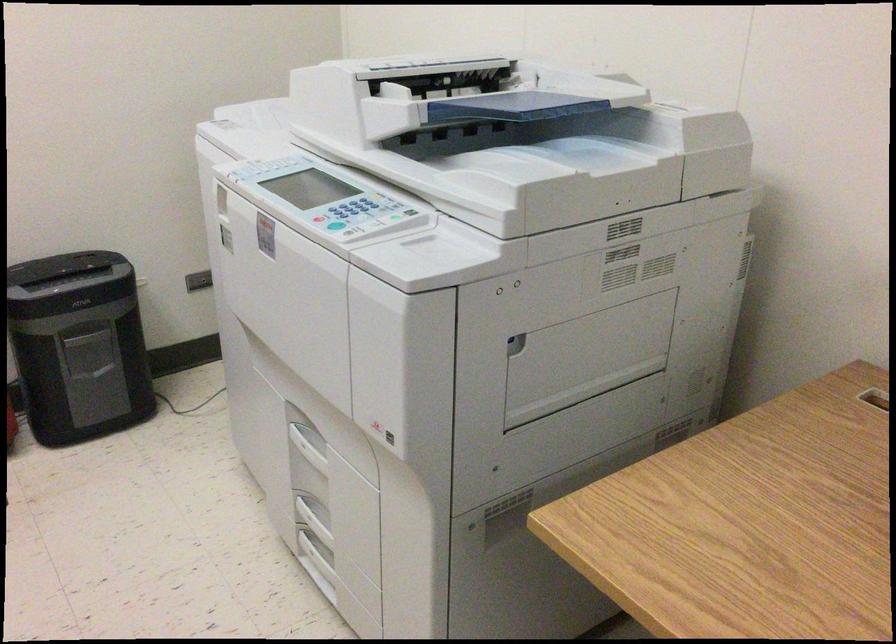
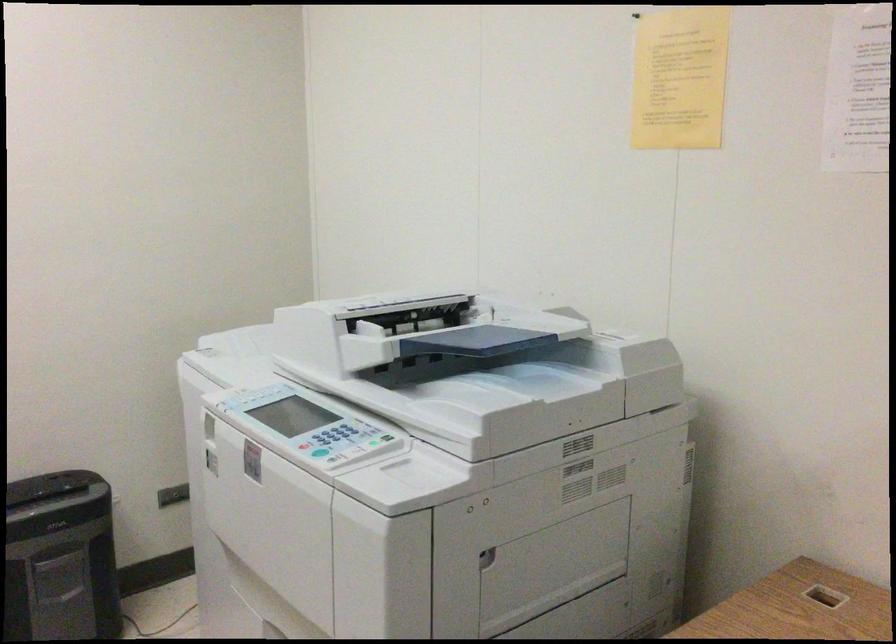
Find the pixel in the second image that matches (581,357) in the first image.

(552, 567)